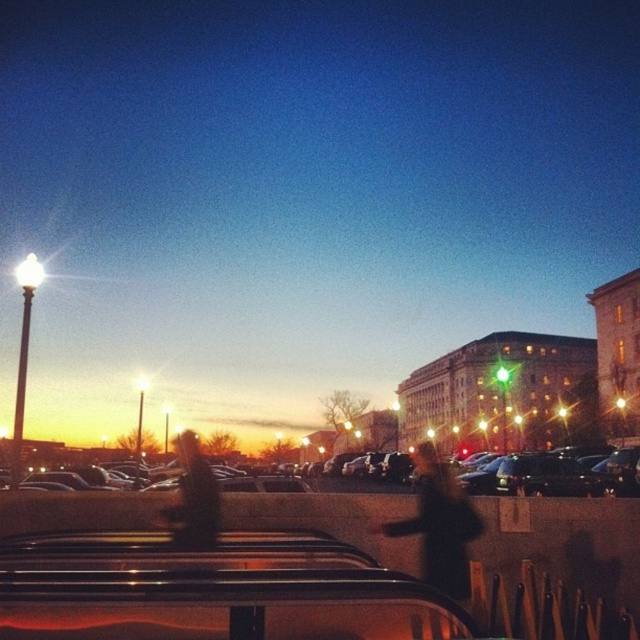
Question: Which object is farther from the camera taking this photo?

Choices:
 (A) dark brown leather jacket at center
 (B) metallic gray cars at center
 (C) black matte coat at center

Answer: (B)

Question: Is black matte coat at center smaller than dark brown leather jacket at center?

Choices:
 (A) no
 (B) yes

Answer: (B)

Question: Which point is closer to the camera taking this photo?

Choices:
 (A) pos(433,532)
 (B) pos(596,477)
 (C) pos(204,480)

Answer: (A)

Question: Considering the real-world distances, which object is closest to the black matte coat at center?

Choices:
 (A) metallic gray cars at center
 (B) dark brown leather jacket at center

Answer: (A)

Question: Is metallic gray cars at center above dark brown leather jacket at center?

Choices:
 (A) yes
 (B) no

Answer: (A)

Question: Is metallic gray cars at center below black matte coat at center?

Choices:
 (A) yes
 (B) no

Answer: (A)